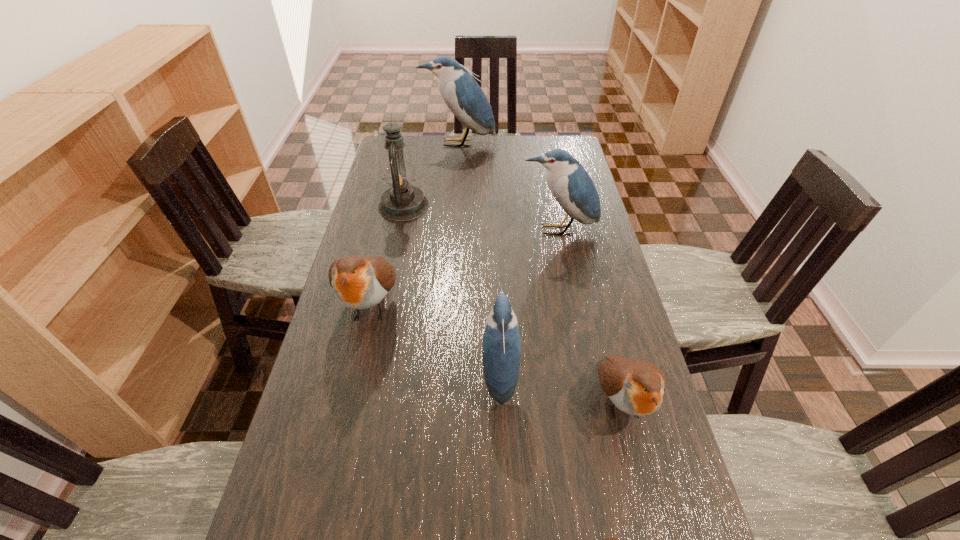
This screenshot has width=960, height=540. In order to click on vacant area that lies between the second tallest bird and the nearest blue bird in this screenshot , I will do `click(529, 302)`.

Locate which object is the closest to the second tallest bird. Please provide its 2D coordinates. Your answer should be formatted as a tuple, i.e. [(x, y)], where the tuple contains the x and y coordinates of a point satisfying the conditions above.

[(402, 202)]

You are a GUI agent. You are given a task and a screenshot of the screen. Output one action in this format:
    pyautogui.click(x=<x>, y=<y>)
    Task: Click on the object that ranks as the sixth closest to the nearest blue bird
    This screenshot has height=540, width=960.
    Given the screenshot: What is the action you would take?
    pyautogui.click(x=462, y=94)

Choose which bird is the fifth nearest neighbor to the shortest bird. Please provide its 2D coordinates. Your answer should be formatted as a tuple, i.e. [(x, y)], where the tuple contains the x and y coordinates of a point satisfying the conditions above.

[(462, 94)]

Identify which bird is the fifth closest to the oil lamp. Please provide its 2D coordinates. Your answer should be formatted as a tuple, i.e. [(x, y)], where the tuple contains the x and y coordinates of a point satisfying the conditions above.

[(636, 387)]

Identify which blue bird is the closest to the biggest blue bird. Please provide its 2D coordinates. Your answer should be formatted as a tuple, i.e. [(x, y)], where the tuple contains the x and y coordinates of a point satisfying the conditions above.

[(570, 184)]

Find the location of a particular element. The image size is (960, 540). the closest blue bird to the biggest blue bird is located at coordinates (570, 184).

Select which brown bird is the closest to the farthest object. Please provide its 2D coordinates. Your answer should be formatted as a tuple, i.e. [(x, y)], where the tuple contains the x and y coordinates of a point satisfying the conditions above.

[(359, 282)]

Choose which brown bird is the second nearest neighbor to the smallest blue bird. Please provide its 2D coordinates. Your answer should be formatted as a tuple, i.e. [(x, y)], where the tuple contains the x and y coordinates of a point satisfying the conditions above.

[(359, 282)]

Find the location of a particular element. free space that satisfies the following two spatial constraints: 1. at the tip of the second tallest bird's beak; 2. at the tip of the nearest blue bird's beak is located at coordinates (587, 374).